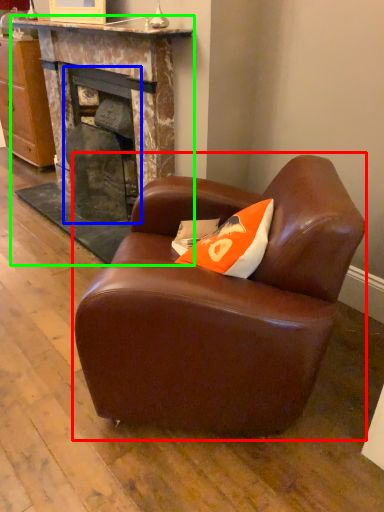
Question: Considering the real-world distances, which object is closest to chair (highlighted by a red box)? fireplace (highlighted by a blue box) or fireplace (highlighted by a green box).

Choices:
 (A) fireplace
 (B) fireplace

Answer: (B)